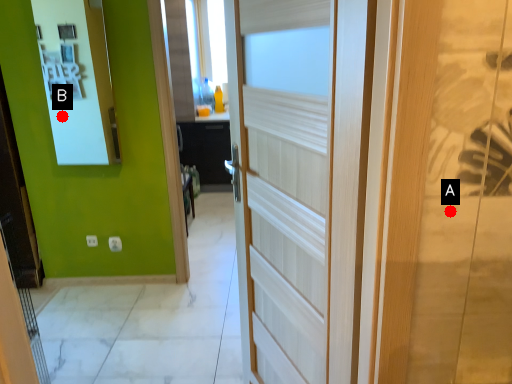
Question: Two points are circled on the image, labeled by A and B beside each circle. Which of the following is the farthest from the observer?

Choices:
 (A) A is further
 (B) B is further

Answer: (B)